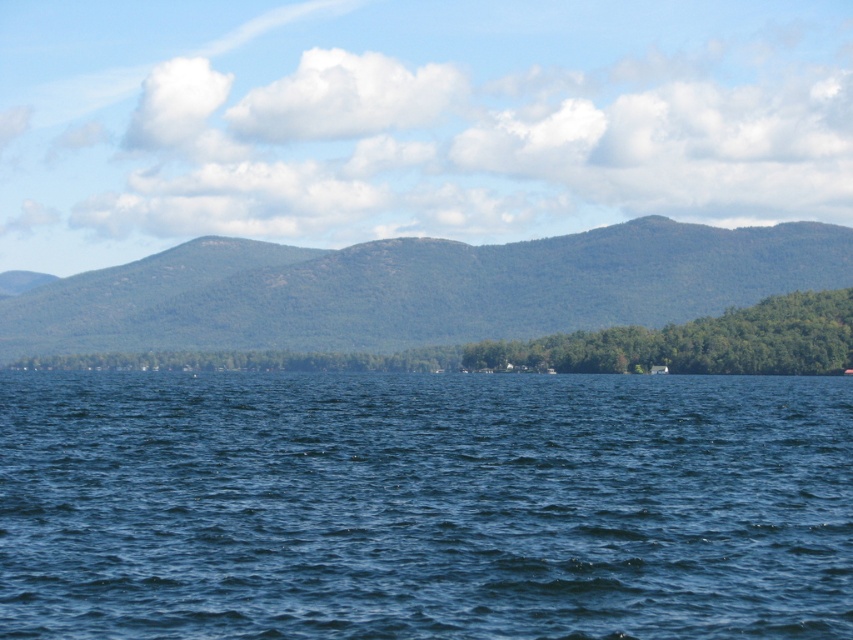
Question: Is blue liquid water at center further to the viewer compared to green forested mountain at center?

Choices:
 (A) no
 (B) yes

Answer: (A)

Question: Which point appears farthest from the camera in this image?

Choices:
 (A) (107, 600)
 (B) (318, 268)

Answer: (B)

Question: Among these points, which one is farthest from the camera?

Choices:
 (A) (35, 326)
 (B) (654, 627)

Answer: (A)

Question: Which object appears closest to the camera in this image?

Choices:
 (A) green forested mountain at center
 (B) blue liquid water at center

Answer: (B)

Question: Is blue liquid water at center positioned behind green forested mountain at center?

Choices:
 (A) yes
 (B) no

Answer: (B)

Question: Does blue liquid water at center have a larger size compared to green forested mountain at center?

Choices:
 (A) yes
 (B) no

Answer: (B)